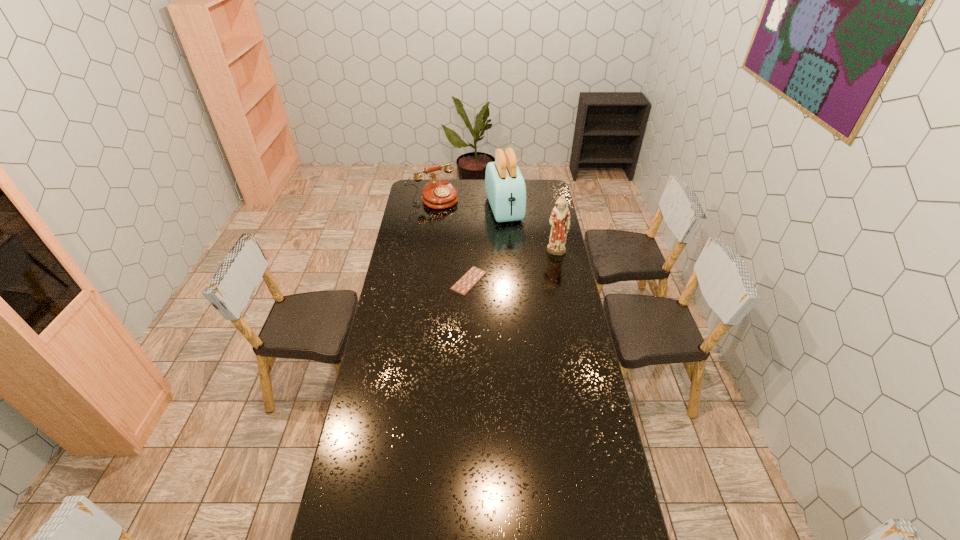
The height and width of the screenshot is (540, 960). What are the coordinates of `free space located on the side of the toaster with the lever` in the screenshot? It's located at (523, 262).

Locate an element on the screen. Image resolution: width=960 pixels, height=540 pixels. vacant area situated on the dial of the second shortest object is located at coordinates pos(466,230).

This screenshot has width=960, height=540. Find the location of `blank space located on the dial of the second shortest object`. blank space located on the dial of the second shortest object is located at coordinates pyautogui.click(x=449, y=213).

The image size is (960, 540). I want to click on free space located on the dial of the second shortest object, so click(472, 237).

Where is `toaster located at the far edge`? This screenshot has width=960, height=540. toaster located at the far edge is located at coordinates (505, 187).

Locate an element on the screen. The image size is (960, 540). telephone situated at the far edge is located at coordinates [438, 194].

In order to click on object present at the left edge in this screenshot , I will do `click(438, 194)`.

Find the location of `object that is at the right edge`. object that is at the right edge is located at coordinates (559, 220).

Where is `object located at the far left corner`? This screenshot has width=960, height=540. object located at the far left corner is located at coordinates point(438,194).

Image resolution: width=960 pixels, height=540 pixels. I want to click on free space at the near edge of the desktop, so click(524, 524).